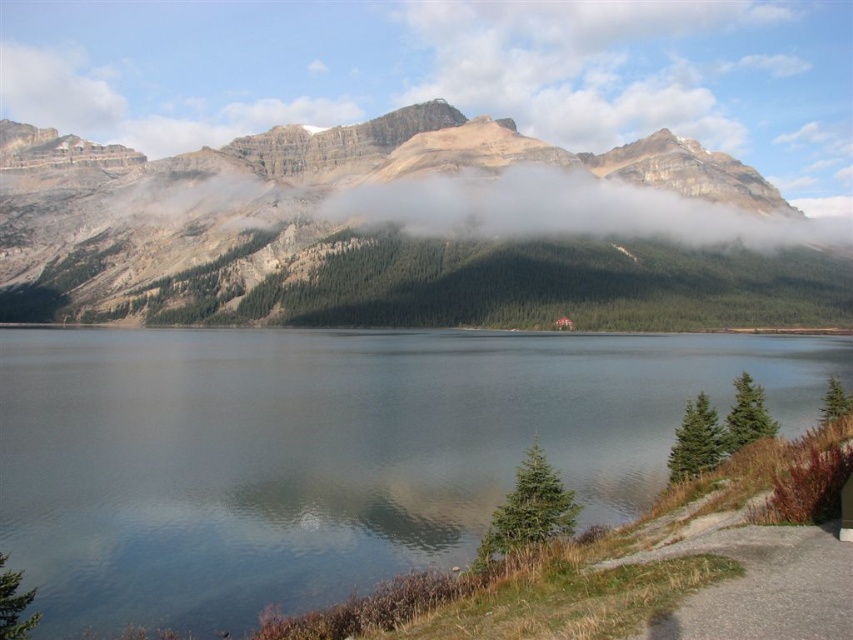
Question: Which object appears closest to the camera in this image?

Choices:
 (A) clear water at center
 (B) rocky mountain at center

Answer: (A)

Question: Can you confirm if clear water at center is positioned below rocky mountain at center?

Choices:
 (A) no
 (B) yes

Answer: (B)

Question: Which of the following is the farthest from the observer?

Choices:
 (A) clear water at center
 (B) rocky mountain at center

Answer: (B)

Question: Is clear water at center smaller than rocky mountain at center?

Choices:
 (A) yes
 (B) no

Answer: (A)

Question: Is clear water at center above rocky mountain at center?

Choices:
 (A) yes
 (B) no

Answer: (B)

Question: Which point is farther to the camera?

Choices:
 (A) rocky mountain at center
 (B) clear water at center

Answer: (A)